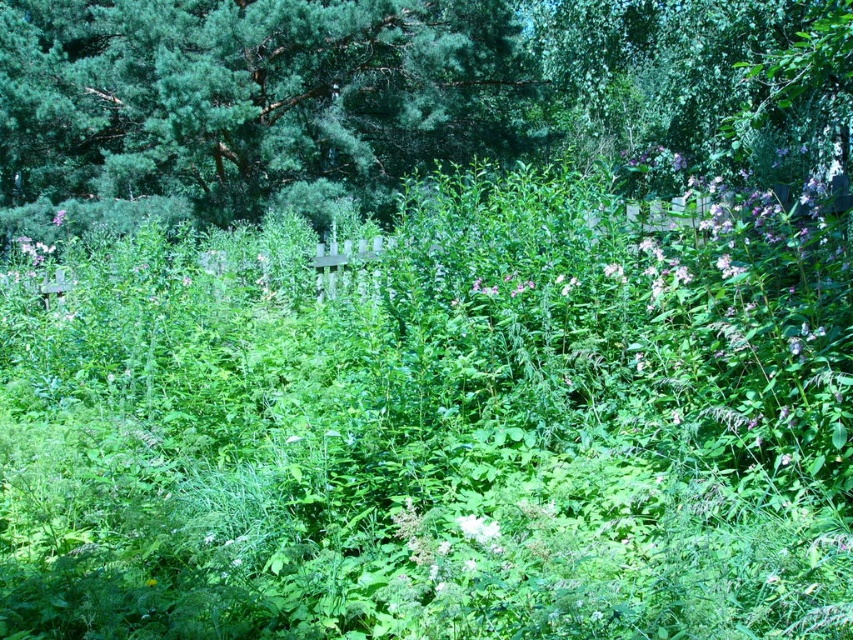
You are a gardener who wants to plant a new flower that requires more sunlight. You have two options in the garden scene shown. Which flower, the pink matte flower at center or the purple matte flower at upper left, is positioned in a sunnier spot?

The purple matte flower at upper left is positioned in a sunnier spot because it is located at the upper left, which is closer to the sunlight source filtering through the leaves in the background.

You are standing in the garden and see the point marked as point (401,99). What type of vegetation is located at that point?

The vegetation at point (401,99) is green needle like.